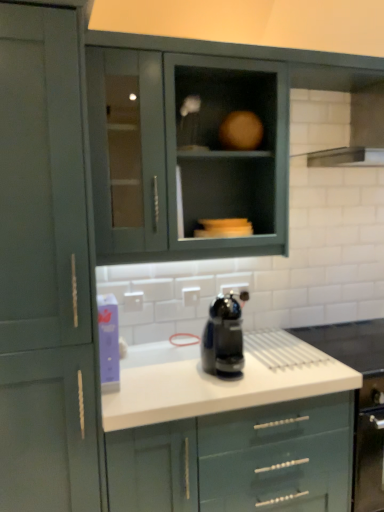
Question: Relative to matte green cabinet at left, the 1th cabinetry viewed from the left, is matte gray cabinet at upper center, which is counted as the second cabinetry, starting from the right, in front or behind?

Choices:
 (A) behind
 (B) front

Answer: (A)

Question: In the image, is matte gray cabinet at upper center, which is the second cabinetry from left to right, on the left side or the right side of matte green cabinet at left, the 1th cabinetry viewed from the left?

Choices:
 (A) right
 (B) left

Answer: (A)

Question: Estimate the real-world distances between objects in this image. Which object is farther from the matte gray cabinet at upper center, which is counted as the second cabinetry, starting from the right?

Choices:
 (A) white glossy countertop at center, placed as the 1th cabinetry when sorted from right to left
 (B) black glossy coffee maker at center
 (C) stainless steel exhaust hood at upper right
 (D) matte green cabinet at left, the third cabinetry from the right

Answer: (A)

Question: Which object is positioned farthest from the white glossy countertop at center, marked as the 3th cabinetry in a left-to-right arrangement?

Choices:
 (A) stainless steel exhaust hood at upper right
 (B) matte gray cabinet at upper center, which is the second cabinetry from left to right
 (C) black glossy coffee maker at center
 (D) matte green cabinet at left, the 1th cabinetry viewed from the left

Answer: (A)